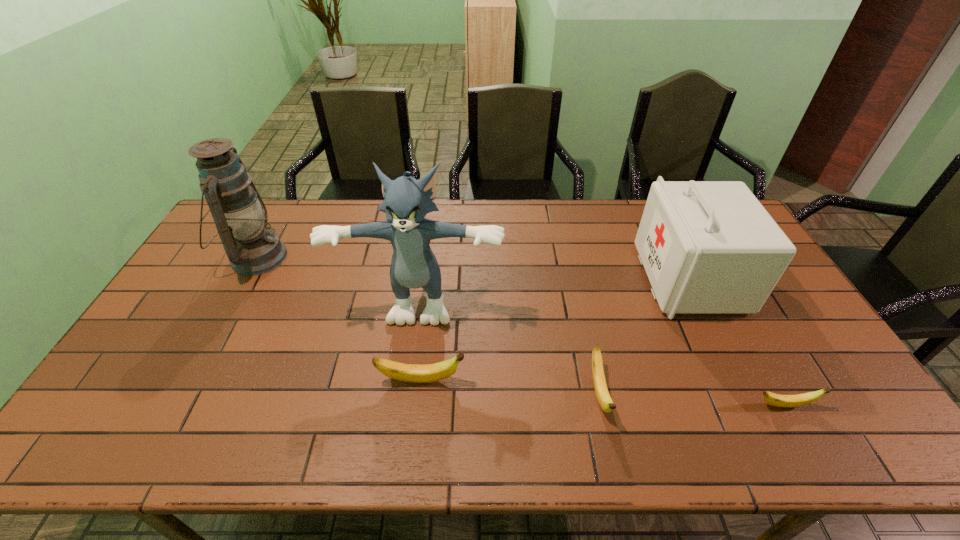
Identify the location of object at the far left corner. The image size is (960, 540). (240, 216).

Locate an element on the screen. Image resolution: width=960 pixels, height=540 pixels. object located at the near right corner is located at coordinates (787, 401).

Identify the location of vacant space at the far edge of the desktop. (443, 210).

Find the location of a particular element. vacant position at the near edge of the desktop is located at coordinates (504, 384).

Identify the location of vacant space at the left edge. click(149, 363).

At what (x,y) coordinates should I click in order to perform the action: click on free space at the right edge of the desktop. Please return your answer as a coordinate pair (x, y). Looking at the image, I should click on (770, 313).

In the image, there is a desktop. Identify the location of vacant space at the near right corner. This screenshot has height=540, width=960. (794, 382).

I want to click on free space between the third tallest object and the fourth object from left to right, so click(x=644, y=335).

Where is `vacant space that's between the oil lamp and the cat`? This screenshot has width=960, height=540. vacant space that's between the oil lamp and the cat is located at coordinates (339, 276).

You are a GUI agent. You are given a task and a screenshot of the screen. Output one action in this format:
    pyautogui.click(x=<x>, y=<y>)
    Task: Click on the free space between the oil lamp and the first-aid kit
    This screenshot has height=540, width=960.
    Given the screenshot: What is the action you would take?
    pyautogui.click(x=473, y=268)